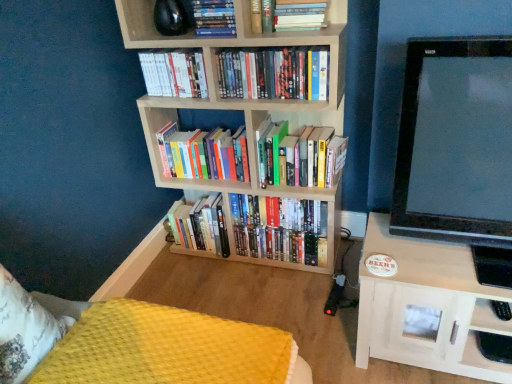
Question: Is hardcover books at center, the fifth book when ordered from bottom to top, next to hardcover books at center, marked as the 2th book in a bottom-to-top arrangement, and touching it?

Choices:
 (A) yes
 (B) no

Answer: (B)

Question: Considering the relative sizes of hardcover books at center, placed as the fourth book when sorted from top to bottom, and hardcover books at center, marked as the 2th book in a bottom-to-top arrangement, in the image provided, is hardcover books at center, placed as the fourth book when sorted from top to bottom, thinner than hardcover books at center, marked as the 2th book in a bottom-to-top arrangement,?

Choices:
 (A) yes
 (B) no

Answer: (A)

Question: Can we say hardcover books at center, the fifth book when ordered from bottom to top, lies outside hardcover books at center, the seventh book when ordered from top to bottom?

Choices:
 (A) no
 (B) yes

Answer: (B)

Question: Does hardcover books at center, the fifth book when ordered from bottom to top, have a lesser height compared to hardcover books at center, marked as the 2th book in a bottom-to-top arrangement?

Choices:
 (A) yes
 (B) no

Answer: (A)

Question: Does hardcover books at center, the fifth book when ordered from bottom to top, have a greater width compared to hardcover books at center, the seventh book when ordered from top to bottom?

Choices:
 (A) no
 (B) yes

Answer: (A)

Question: Visually, is hardcover books at center, the 6th book viewed from the top, positioned to the left or to the right of white paperback book at upper left, arranged as the 3th book when viewed from the top?

Choices:
 (A) left
 (B) right

Answer: (B)

Question: Considering the positions of hardcover books at center, the 6th book viewed from the top, and white paperback book at upper left, arranged as the 3th book when viewed from the top, in the image, is hardcover books at center, the 6th book viewed from the top, taller or shorter than white paperback book at upper left, arranged as the 3th book when viewed from the top,?

Choices:
 (A) short
 (B) tall

Answer: (B)

Question: Considering the positions of point (330, 180) and point (159, 77), is point (330, 180) closer or farther from the camera than point (159, 77)?

Choices:
 (A) closer
 (B) farther

Answer: (A)

Question: Is hardcover books at center, which ranks as the 3th book in bottom-to-top order, wider or thinner than white paperback book at upper left, arranged as the 3th book when viewed from the top?

Choices:
 (A) wide
 (B) thin

Answer: (A)

Question: Is hardcover books at center, which ranks as the 3th book in bottom-to-top order, taller or shorter than hardcover books at center, placed as the fourth book when sorted from top to bottom?

Choices:
 (A) tall
 (B) short

Answer: (A)

Question: Considering the positions of hardcover books at center, which ranks as the 3th book in bottom-to-top order, and hardcover books at center, the fifth book when ordered from bottom to top, in the image, is hardcover books at center, which ranks as the 3th book in bottom-to-top order, wider or thinner than hardcover books at center, the fifth book when ordered from bottom to top,?

Choices:
 (A) wide
 (B) thin

Answer: (A)

Question: In the image, is hardcover books at center, the 6th book viewed from the top, positioned in front of or behind hardcover books at center, the fifth book when ordered from bottom to top?

Choices:
 (A) behind
 (B) front

Answer: (A)

Question: Is hardcover books at center, the 6th book viewed from the top, situated inside hardcover books at center, the fifth book when ordered from bottom to top, or outside?

Choices:
 (A) inside
 (B) outside

Answer: (B)

Question: Is point (401, 327) closer or farther from the camera than point (186, 87)?

Choices:
 (A) closer
 (B) farther

Answer: (A)

Question: From a real-world perspective, relative to white paperback book at upper left, which ranks as the sixth book in bottom-to-top order, is white wood shelf at right vertically above or below?

Choices:
 (A) above
 (B) below

Answer: (B)